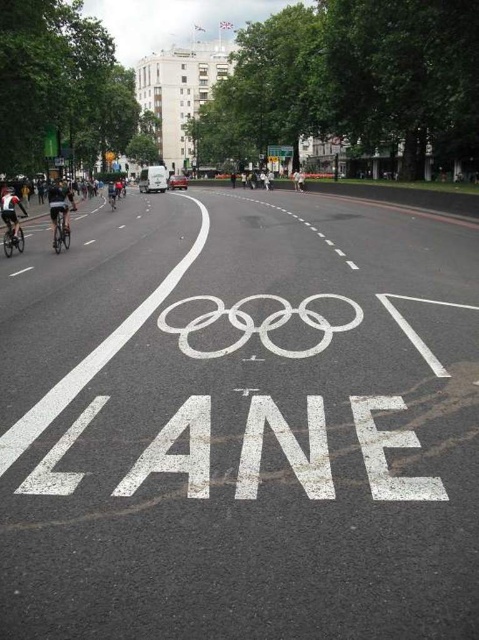
Is point (202, 301) positioned in front of point (269, 150)?

Yes, it is.

Who is lower down, white asphalt bike lane at center or white plastic sign at center?

white asphalt bike lane at center

The image size is (479, 640). In order to click on white asphalt bike lane at center in this screenshot , I will do `click(240, 422)`.

Which is behind, point (224, 442) or point (60, 209)?

The point (60, 209) is behind.

Describe the element at coordinates (240, 422) in the screenshot. I see `white asphalt bike lane at center` at that location.

Locate an element on the screen. This screenshot has height=640, width=479. white asphalt bike lane at center is located at coordinates (240, 422).

Does silver metallic bicycle at left lie in front of shiny silver bicycle at left?

No.

Does point (57, 246) lie behind point (11, 234)?

No, (57, 246) is closer to viewer.

Locate an element on the screen. silver metallic bicycle at left is located at coordinates (60, 228).